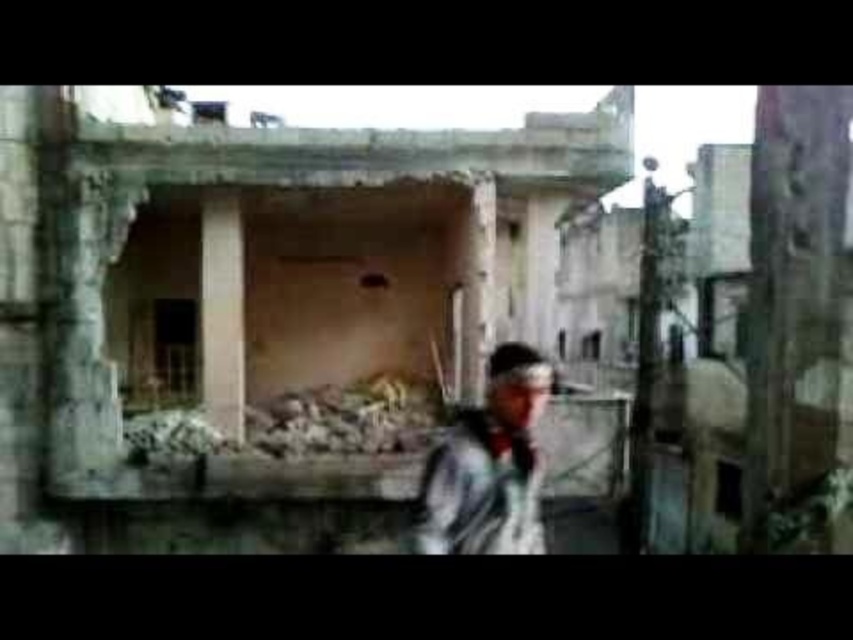
Which is more to the right, concrete rubble at center or gray fabric jacket at center?

From the viewer's perspective, concrete rubble at center appears more on the right side.

Does concrete rubble at center appear on the left side of gray fabric jacket at center?

In fact, concrete rubble at center is to the right of gray fabric jacket at center.

Is point (273, 388) behind point (534, 365)?

Yes, it is.

I want to click on concrete rubble at center, so click(x=300, y=291).

Between concrete rubble at center and rusty concrete rubble at center, which one is positioned lower?

rusty concrete rubble at center

Does point (90, 173) come in front of point (190, 445)?

Yes, it is.

Describe the element at coordinates (300, 291) in the screenshot. This screenshot has width=853, height=640. I see `concrete rubble at center` at that location.

At what (x,y) coordinates should I click in order to perform the action: click on concrete rubble at center. Please return your answer as a coordinate pair (x, y). Image resolution: width=853 pixels, height=640 pixels. Looking at the image, I should click on (300, 291).

Who is taller, gray fabric jacket at center or brown concrete pillar at center?

Standing taller between the two is brown concrete pillar at center.

Consider the image. Is gray fabric jacket at center closer to the viewer compared to brown concrete pillar at center?

Yes, gray fabric jacket at center is closer to the viewer.

The width and height of the screenshot is (853, 640). Identify the location of gray fabric jacket at center. (488, 465).